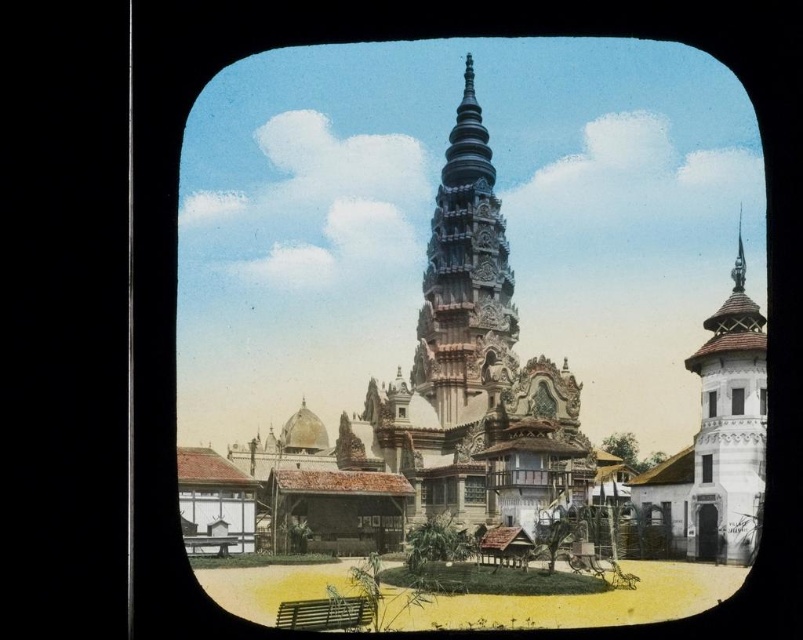
Question: Where is white textured tower at right located in relation to white painted wood window at upper right in the image?

Choices:
 (A) left
 (B) right

Answer: (B)

Question: Can you confirm if black glass window at upper right is positioned to the right of transparent glass window at center right?

Choices:
 (A) yes
 (B) no

Answer: (B)

Question: Among these objects, which one is farthest from the camera?

Choices:
 (A) transparent glass window at center-right
 (B) carved stone tower at center

Answer: (B)

Question: Among these points, which one is farthest from the camera?

Choices:
 (A) (454, 237)
 (B) (706, 472)

Answer: (A)

Question: Is black glass window at upper right positioned before transparent glass window at center?

Choices:
 (A) no
 (B) yes

Answer: (B)

Question: Which of the following is the closest to the observer?

Choices:
 (A) transparent glass window at center
 (B) clear glass window at center

Answer: (B)